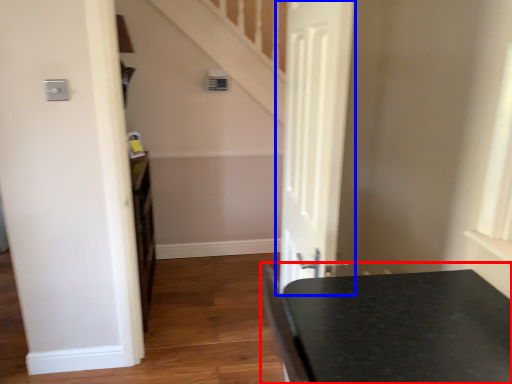
Question: Which of the following is the farthest to the observer, table (highlighted by a red box) or door (highlighted by a blue box)?

Choices:
 (A) table
 (B) door

Answer: (B)